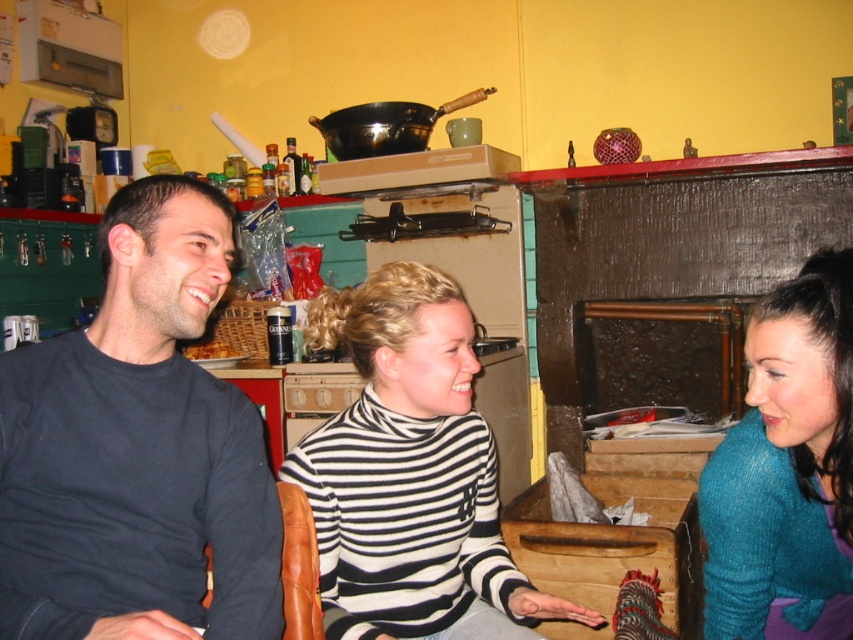
You are a photographer setting up a shoot in this room. You need to position a tall lamp between the black cotton shirt at left and the teal sweater at right. Which side should the lamp be placed closer to?

The black cotton shirt at left is taller than the teal sweater at right, so the lamp should be placed closer to the black cotton shirt at left to maintain balance in the composition.

You are a guest in this home and want to grab the brown crumbly bread at left without touching the black cotton shirt at left. Is this possible?

The black cotton shirt at left is positioned under the brown crumbly bread at left, so you can reach up and take the bread without touching the shirt.